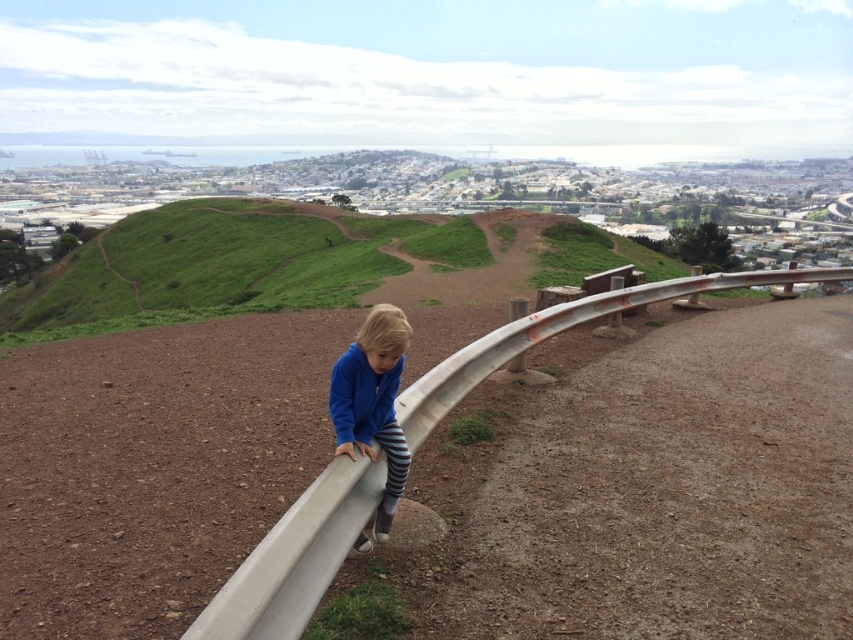
Question: Is green grassy hillside at upper center below blue fleece jacket at center?

Choices:
 (A) no
 (B) yes

Answer: (A)

Question: Which of these objects is positioned farthest from the green grassy hillside at upper center?

Choices:
 (A) blue fleece jacket at center
 (B) white matte rail at center

Answer: (A)

Question: Which object is positioned closest to the green grassy hillside at upper center?

Choices:
 (A) blue fleece jacket at center
 (B) white matte rail at center

Answer: (B)

Question: Does white matte rail at center come in front of blue fleece jacket at center?

Choices:
 (A) yes
 (B) no

Answer: (A)

Question: Does green grassy hillside at upper center appear on the left side of white matte rail at center?

Choices:
 (A) no
 (B) yes

Answer: (B)

Question: Among these objects, which one is farthest from the camera?

Choices:
 (A) blue fleece jacket at center
 (B) green grassy hillside at upper center

Answer: (B)